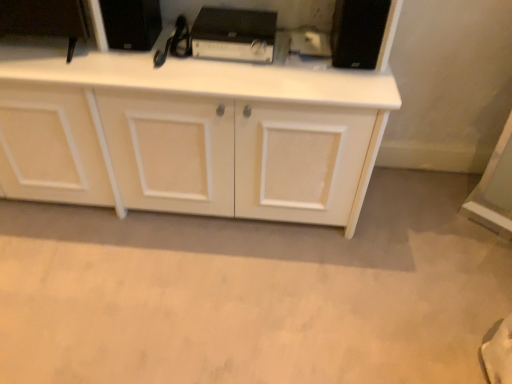
Question: Is black matte speaker at upper right, the third appliance in the left-to-right sequence, further to camera compared to white matte cabinet at center?

Choices:
 (A) yes
 (B) no

Answer: (A)

Question: Is black matte speaker at upper right, positioned as the 1th appliance in right-to-left order, shorter than white matte cabinet at center?

Choices:
 (A) no
 (B) yes

Answer: (B)

Question: Is black matte speaker at upper right, positioned as the 1th appliance in right-to-left order, wider than white matte cabinet at center?

Choices:
 (A) no
 (B) yes

Answer: (A)

Question: Is black matte speaker at upper right, the third appliance in the left-to-right sequence, bigger than white matte cabinet at center?

Choices:
 (A) no
 (B) yes

Answer: (A)

Question: Is white matte cabinet at center surrounded by black matte speaker at upper right, positioned as the 1th appliance in right-to-left order?

Choices:
 (A) no
 (B) yes

Answer: (A)

Question: Choose the correct answer: Is white matte cabinet at center inside black plastic amplifier at center, which ranks as the 2th appliance in left-to-right order, or outside it?

Choices:
 (A) inside
 (B) outside

Answer: (B)

Question: Is white matte cabinet at center bigger or smaller than black plastic amplifier at center, arranged as the second appliance when viewed from the right?

Choices:
 (A) big
 (B) small

Answer: (A)

Question: Considering their positions, is white matte cabinet at center located in front of or behind black plastic amplifier at center, arranged as the second appliance when viewed from the right?

Choices:
 (A) front
 (B) behind

Answer: (A)

Question: Is white matte cabinet at center to the left or to the right of black plastic amplifier at center, arranged as the second appliance when viewed from the right, in the image?

Choices:
 (A) right
 (B) left

Answer: (B)

Question: Looking at their shapes, would you say black plastic amplifier at center, which ranks as the 2th appliance in left-to-right order, is wider or thinner than black matte speaker at upper center, positioned as the 1th appliance in left-to-right order?

Choices:
 (A) thin
 (B) wide

Answer: (B)

Question: From the image's perspective, is black plastic amplifier at center, which ranks as the 2th appliance in left-to-right order, above or below black matte speaker at upper center, which ranks as the third appliance in right-to-left order?

Choices:
 (A) below
 (B) above

Answer: (A)

Question: Visually, is black plastic amplifier at center, which ranks as the 2th appliance in left-to-right order, positioned to the left or to the right of black matte speaker at upper center, positioned as the 1th appliance in left-to-right order?

Choices:
 (A) left
 (B) right

Answer: (B)

Question: From their relative heights in the image, would you say black plastic amplifier at center, which ranks as the 2th appliance in left-to-right order, is taller or shorter than black matte speaker at upper center, positioned as the 1th appliance in left-to-right order?

Choices:
 (A) short
 (B) tall

Answer: (A)

Question: From the image's perspective, is black matte speaker at upper right, positioned as the 1th appliance in right-to-left order, located above or below black plastic amplifier at center, arranged as the second appliance when viewed from the right?

Choices:
 (A) above
 (B) below

Answer: (B)

Question: Based on their positions, is black matte speaker at upper right, the third appliance in the left-to-right sequence, located to the left or right of black plastic amplifier at center, which ranks as the 2th appliance in left-to-right order?

Choices:
 (A) right
 (B) left

Answer: (A)